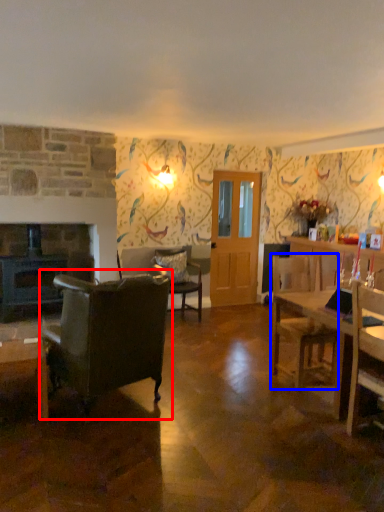
Question: Which of the following is the farthest to the observer, chair (highlighted by a red box) or chair (highlighted by a blue box)?

Choices:
 (A) chair
 (B) chair

Answer: (B)